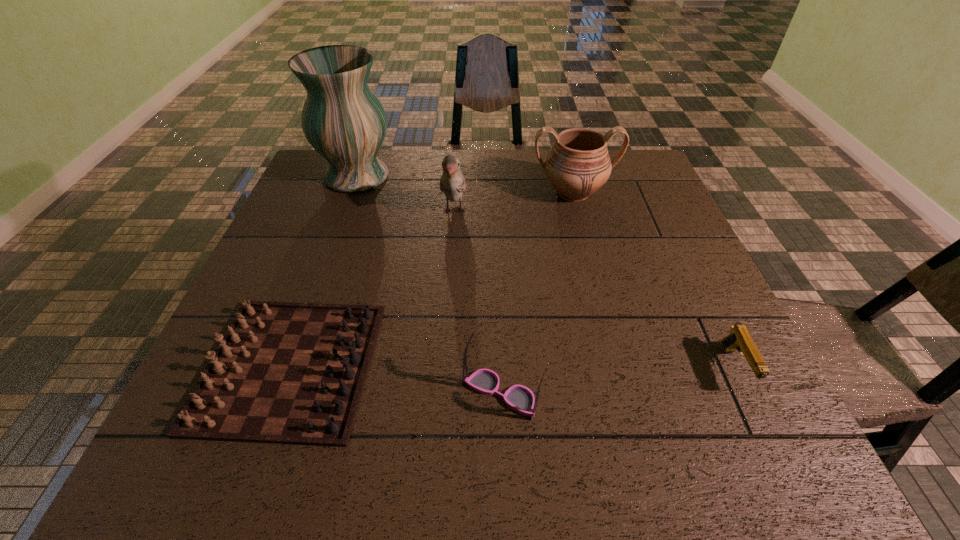
The width and height of the screenshot is (960, 540). What are the coordinates of `object positioned at the far left corner` in the screenshot? It's located at (343, 120).

Identify the location of object that is positioned at the near left corner. (292, 373).

Locate an element on the screen. The width and height of the screenshot is (960, 540). object located in the far right corner section of the desktop is located at coordinates (578, 164).

Where is `vacant space at the far edge of the desktop`? The image size is (960, 540). vacant space at the far edge of the desktop is located at coordinates (477, 181).

Identify the location of free space at the near edge. Image resolution: width=960 pixels, height=540 pixels. (628, 434).

In the image, there is a desktop. Identify the location of free space at the right edge. The image size is (960, 540). (684, 275).

In the image, there is a desktop. Identify the location of blank space at the far left corner. (300, 186).

I want to click on vacant space at the near right corner, so coord(738,464).

Locate an element on the screen. This screenshot has width=960, height=540. vacant area that lies between the chessboard and the spectacles is located at coordinates (396, 380).

Where is `empty space between the urn and the bird`? This screenshot has width=960, height=540. empty space between the urn and the bird is located at coordinates (514, 202).